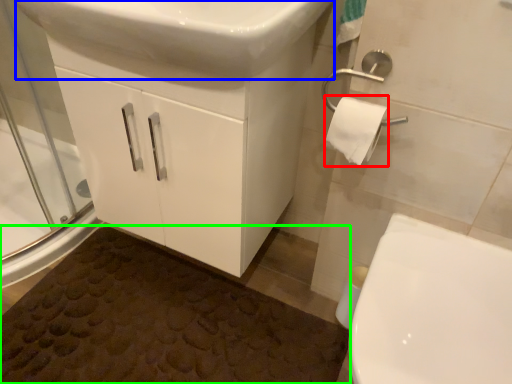
Question: Considering the real-world distances, which object is farthest from toilet paper (highlighted by a red box)? sink (highlighted by a blue box) or bath mat (highlighted by a green box)?

Choices:
 (A) sink
 (B) bath mat

Answer: (B)